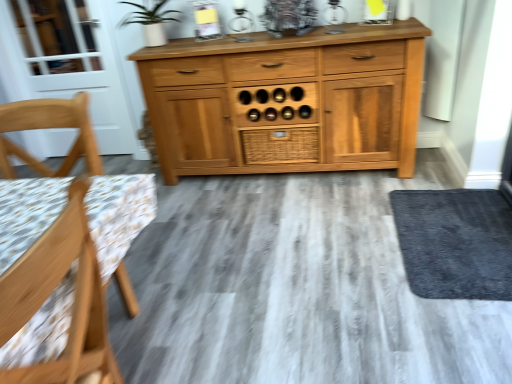
Question: From a real-world perspective, is white glass screen door at left on top of woven wood drawer at center?

Choices:
 (A) yes
 (B) no

Answer: (A)

Question: Does white glass screen door at left lie in front of woven wood drawer at center?

Choices:
 (A) no
 (B) yes

Answer: (A)

Question: Considering the relative sizes of white glass screen door at left and woven wood drawer at center in the image provided, is white glass screen door at left smaller than woven wood drawer at center?

Choices:
 (A) yes
 (B) no

Answer: (B)

Question: From the image's perspective, is white glass screen door at left beneath woven wood drawer at center?

Choices:
 (A) no
 (B) yes

Answer: (A)

Question: Is white glass screen door at left taller than woven wood drawer at center?

Choices:
 (A) yes
 (B) no

Answer: (A)

Question: Does white glass screen door at left turn towards woven wood drawer at center?

Choices:
 (A) yes
 (B) no

Answer: (B)

Question: Can we say wooden chair at left, which appears as the first chair when viewed from the front, lies outside dark gray carpet at lower right?

Choices:
 (A) yes
 (B) no

Answer: (A)

Question: Is wooden chair at left, which appears as the first chair when viewed from the front, placed right next to dark gray carpet at lower right?

Choices:
 (A) yes
 (B) no

Answer: (B)

Question: Is wooden chair at left, which is counted as the 2th chair, starting from the back, behind dark gray carpet at lower right?

Choices:
 (A) no
 (B) yes

Answer: (A)

Question: Does wooden chair at left, which appears as the first chair when viewed from the front, have a larger size compared to dark gray carpet at lower right?

Choices:
 (A) no
 (B) yes

Answer: (B)

Question: Can you confirm if wooden chair at left, which appears as the first chair when viewed from the front, is thinner than dark gray carpet at lower right?

Choices:
 (A) yes
 (B) no

Answer: (A)

Question: Is wooden chair at left, which is counted as the 2th chair, starting from the back, positioned far away from dark gray carpet at lower right?

Choices:
 (A) no
 (B) yes

Answer: (B)

Question: From a real-world perspective, is light wood chair at left, which is the second chair from front to back, on wooden chair at left, which appears as the first chair when viewed from the front?

Choices:
 (A) yes
 (B) no

Answer: (B)